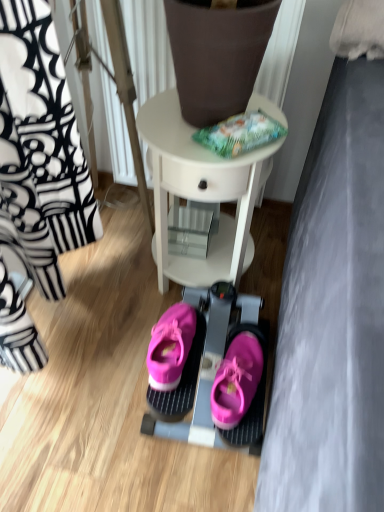
Question: Would you say pink suede sneakers at center is to the left or to the right of pink fabric sneakers at center in the picture?

Choices:
 (A) right
 (B) left

Answer: (B)

Question: From their relative heights in the image, would you say pink suede sneakers at center is taller or shorter than pink fabric sneakers at center?

Choices:
 (A) short
 (B) tall

Answer: (A)

Question: Estimate the real-world distances between objects in this image. Which object is farther from the pink suede sneakers at center?

Choices:
 (A) white glossy table at center
 (B) pink fabric sneakers at center

Answer: (A)

Question: Which object is positioned closest to the pink fabric sneakers at center?

Choices:
 (A) pink suede sneakers at center
 (B) white glossy table at center

Answer: (A)